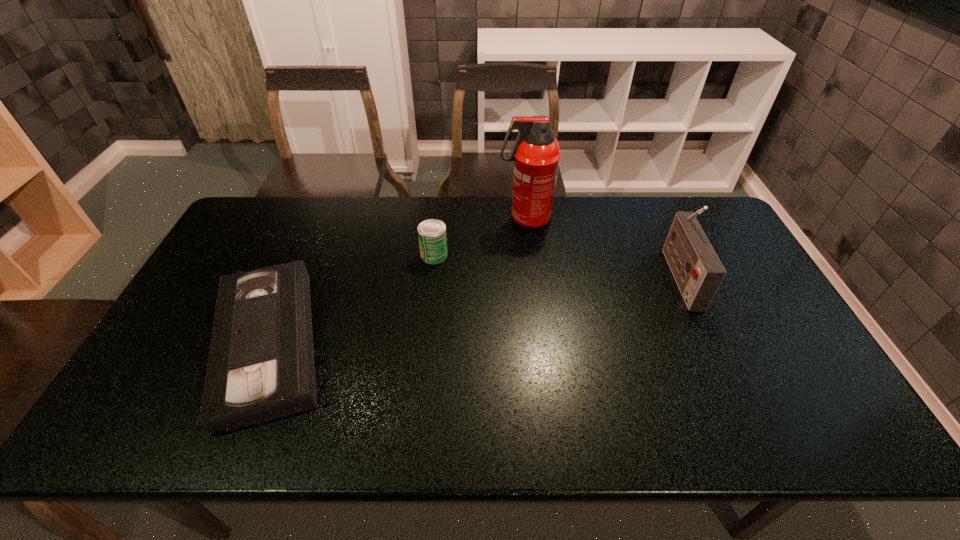
Identify the location of vacant space in between the rightmost object and the second shortest object. The image size is (960, 540). (557, 265).

Find the location of a particular element. This screenshot has width=960, height=540. free space between the radio receiver and the shortest object is located at coordinates (473, 310).

Identify the location of free space between the third tallest object and the rightmost object. Image resolution: width=960 pixels, height=540 pixels. (557, 265).

Locate an element on the screen. The height and width of the screenshot is (540, 960). free space between the third shortest object and the farthest object is located at coordinates (602, 247).

This screenshot has width=960, height=540. In order to click on unoccupied position between the videotape and the third object from right to left in this screenshot , I will do `click(351, 299)`.

At what (x,y) coordinates should I click in order to perform the action: click on object that is the closest to the third object from left to right. Please return your answer as a coordinate pair (x, y). The width and height of the screenshot is (960, 540). Looking at the image, I should click on (432, 233).

Identify which object is the closest to the fire extinguisher. Please provide its 2D coordinates. Your answer should be formatted as a tuple, i.e. [(x, y)], where the tuple contains the x and y coordinates of a point satisfying the conditions above.

[(432, 233)]

What are the coordinates of `vacant region that satisfies the following two spatial constraints: 1. on the trigger side of the tallest object; 2. on the front side of the leftmost object` in the screenshot? It's located at (540, 343).